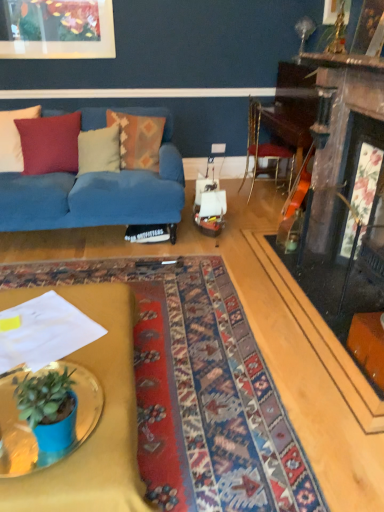
Question: Does soft cotton pillow at center, which is the 2th pillow in right-to-left order, have a greater height compared to white cotton pillow at left, which appears as the 1th pillow when viewed from the left?

Choices:
 (A) yes
 (B) no

Answer: (B)

Question: From a real-world perspective, is soft cotton pillow at center, the third pillow from the left, on white cotton pillow at left, which appears as the 1th pillow when viewed from the left?

Choices:
 (A) no
 (B) yes

Answer: (A)

Question: From the image's perspective, would you say soft cotton pillow at center, the third pillow from the left, is positioned over white cotton pillow at left, which appears as the 4th pillow when viewed from the right?

Choices:
 (A) yes
 (B) no

Answer: (B)

Question: Is soft cotton pillow at center, the third pillow from the left, next to white cotton pillow at left, which appears as the 4th pillow when viewed from the right, and touching it?

Choices:
 (A) no
 (B) yes

Answer: (A)

Question: Can you confirm if soft cotton pillow at center, the third pillow from the left, is shorter than white cotton pillow at left, which appears as the 4th pillow when viewed from the right?

Choices:
 (A) yes
 (B) no

Answer: (A)

Question: Is soft cotton pillow at center, which is the 2th pillow in right-to-left order, outside white cotton pillow at left, which appears as the 1th pillow when viewed from the left?

Choices:
 (A) yes
 (B) no

Answer: (A)

Question: From a real-world perspective, is soft cotton pillow at center, the third pillow from the left, positioned under textured woolen pillow at left, the second pillow positioned from the left, based on gravity?

Choices:
 (A) no
 (B) yes

Answer: (B)

Question: From the image's perspective, would you say soft cotton pillow at center, which is the 2th pillow in right-to-left order, is shown under textured woolen pillow at left, the second pillow positioned from the left?

Choices:
 (A) no
 (B) yes

Answer: (B)

Question: Is soft cotton pillow at center, the third pillow from the left, positioned in front of textured woolen pillow at left, the second pillow positioned from the left?

Choices:
 (A) yes
 (B) no

Answer: (B)

Question: Is soft cotton pillow at center, which is the 2th pillow in right-to-left order, behind textured woolen pillow at left, positioned as the third pillow in right-to-left order?

Choices:
 (A) no
 (B) yes

Answer: (B)

Question: Is soft cotton pillow at center, the third pillow from the left, placed right next to textured woolen pillow at left, positioned as the third pillow in right-to-left order?

Choices:
 (A) no
 (B) yes

Answer: (A)

Question: Is there a large distance between soft cotton pillow at center, the third pillow from the left, and textured woolen pillow at left, positioned as the third pillow in right-to-left order?

Choices:
 (A) yes
 (B) no

Answer: (B)

Question: Is textured woolen pillow at left, the second pillow positioned from the left, facing towards blue fabric couch at left?

Choices:
 (A) yes
 (B) no

Answer: (A)